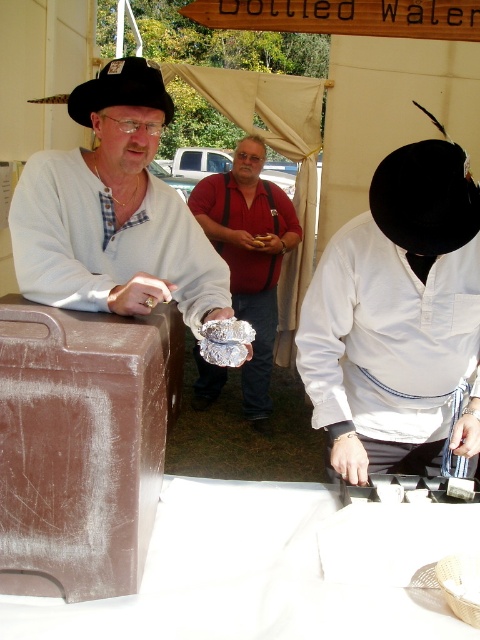
Is the position of white matte table at lower center less distant than that of matte white shirt at left?

Yes, it is.

Who is higher up, white matte table at lower center or matte white shirt at left?

Positioned higher is matte white shirt at left.

Which is behind, point (207, 534) or point (44, 224)?

The point (44, 224) is behind.

Locate an element on the screen. The height and width of the screenshot is (640, 480). white matte table at lower center is located at coordinates 238,579.

Can you confirm if white matte table at lower center is wider than white satin shirt at center?

Yes, white matte table at lower center is wider than white satin shirt at center.

Who is more forward, (172, 512) or (430, 340)?

Positioned in front is point (172, 512).

Describe the element at coordinates (238, 579) in the screenshot. The width and height of the screenshot is (480, 640). I see `white matte table at lower center` at that location.

At what (x,y) coordinates should I click in order to perform the action: click on white matte table at lower center. Please return your answer as a coordinate pair (x, y). This screenshot has height=640, width=480. Looking at the image, I should click on (238, 579).

Does matte white shirt at left appear under matte red shirt at center?

Correct, matte white shirt at left is located below matte red shirt at center.

From the picture: Is matte white shirt at left to the right of matte red shirt at center from the viewer's perspective?

In fact, matte white shirt at left is to the left of matte red shirt at center.

Where is `matte white shirt at left`? This screenshot has width=480, height=640. matte white shirt at left is located at coordinates (113, 212).